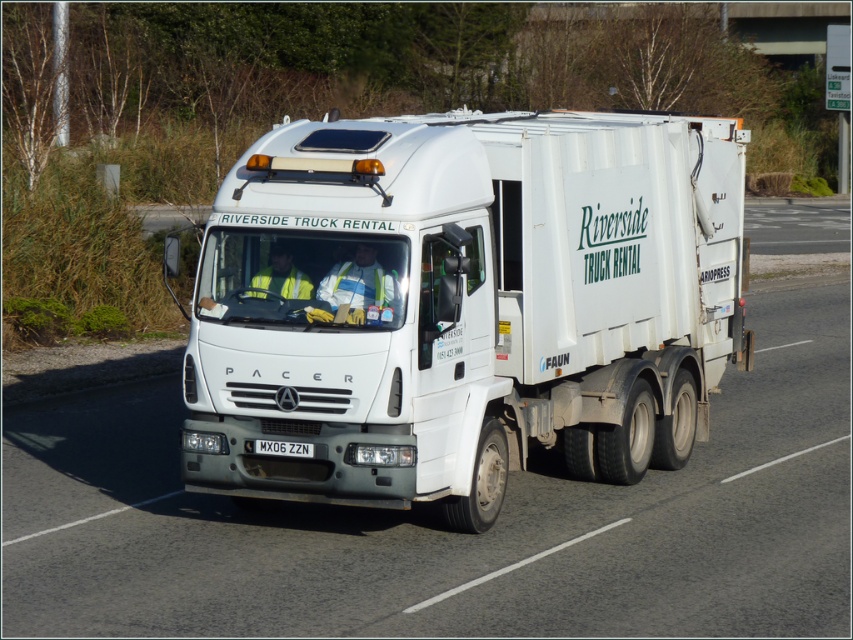
Can you confirm if white matte trailer truck at center is taller than white metallic license plate at center?

Correct, white matte trailer truck at center is much taller as white metallic license plate at center.

This screenshot has width=853, height=640. What do you see at coordinates (463, 305) in the screenshot?
I see `white matte trailer truck at center` at bounding box center [463, 305].

You are a GUI agent. You are given a task and a screenshot of the screen. Output one action in this format:
    pyautogui.click(x=<x>, y=<y>)
    Task: Click on the white matte trailer truck at center
    This screenshot has height=640, width=853.
    Given the screenshot: What is the action you would take?
    pyautogui.click(x=463, y=305)